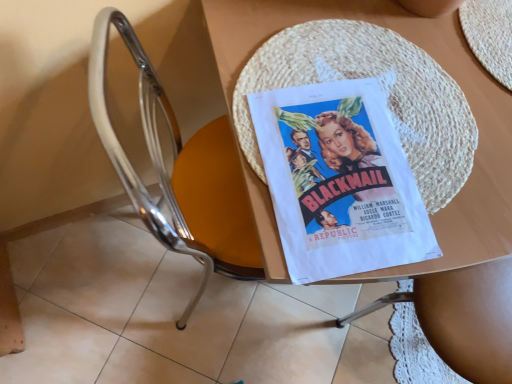
You are a GUI agent. You are given a task and a screenshot of the screen. Output one action in this format:
    pyautogui.click(x=<x>, y=<y>)
    Task: Click on the free space behind white paper poster at center
    
    Given the screenshot: What is the action you would take?
    pyautogui.click(x=371, y=52)